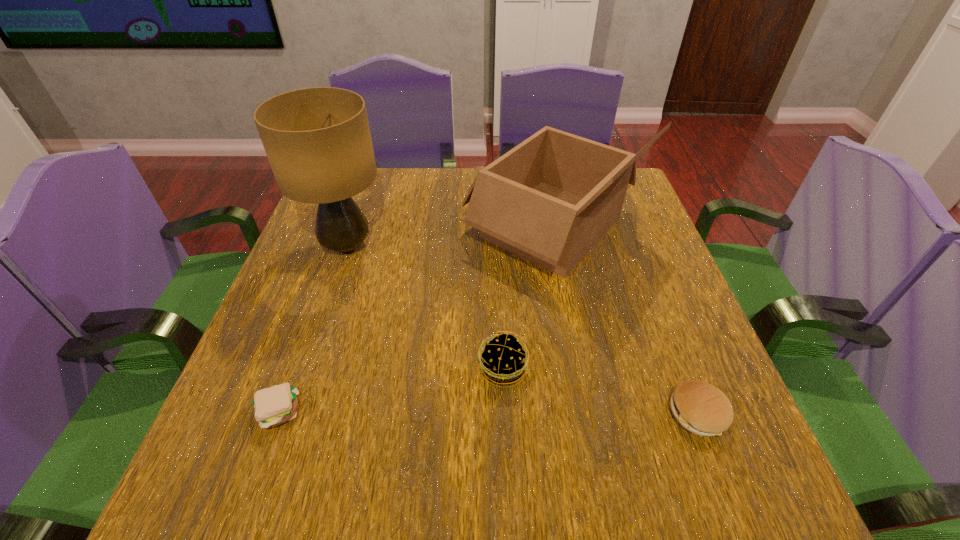
Locate an element on the screen. blank space at the left edge of the desktop is located at coordinates (328, 267).

Identify the location of vacant region at the right edge of the desktop. The image size is (960, 540). (658, 434).

In the image, there is a desktop. Where is `vacant space at the far left corner`? Image resolution: width=960 pixels, height=540 pixels. vacant space at the far left corner is located at coordinates (375, 205).

This screenshot has width=960, height=540. In the image, there is a desktop. What are the coordinates of `vacant space at the near left corner` in the screenshot? It's located at (229, 463).

The image size is (960, 540). I want to click on free space that is in between the tallest patty and the box, so click(x=527, y=298).

Image resolution: width=960 pixels, height=540 pixels. In order to click on vacant area between the tallest object and the rightmost patty in this screenshot , I will do point(522,330).

Where is `vacant space in between the box and the shortest object`? The height and width of the screenshot is (540, 960). vacant space in between the box and the shortest object is located at coordinates (415, 320).

The image size is (960, 540). I want to click on free space between the second tallest object and the rightmost patty, so click(x=624, y=321).

Locate an element on the screen. The width and height of the screenshot is (960, 540). vacant space in between the rightmost patty and the third tallest object is located at coordinates (600, 392).

You are a GUI agent. You are given a task and a screenshot of the screen. Output one action in this format:
    pyautogui.click(x=<x>, y=<y>)
    Task: Click on the vacant space that's between the shortest patty and the tallest object
    The image size is (960, 540).
    Given the screenshot: What is the action you would take?
    pyautogui.click(x=312, y=329)